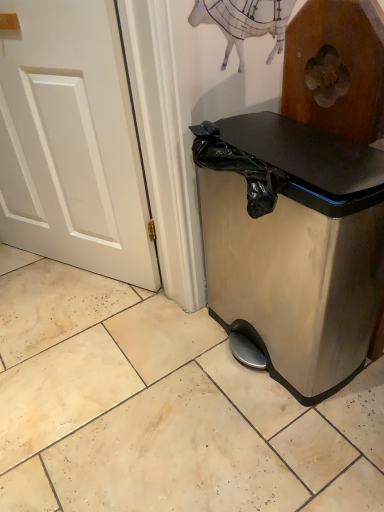
Question: Considering the positions of white painted wood door at left and satin silver trash can at lower right in the image, is white painted wood door at left wider or thinner than satin silver trash can at lower right?

Choices:
 (A) thin
 (B) wide

Answer: (A)

Question: From their relative heights in the image, would you say white painted wood door at left is taller or shorter than satin silver trash can at lower right?

Choices:
 (A) tall
 (B) short

Answer: (A)

Question: Would you say white painted wood door at left is to the left or to the right of satin silver trash can at lower right in the picture?

Choices:
 (A) left
 (B) right

Answer: (A)

Question: Looking at their shapes, would you say satin silver trash can at lower right is wider or thinner than white painted wood door at left?

Choices:
 (A) thin
 (B) wide

Answer: (B)

Question: From the image's perspective, relative to white painted wood door at left, is satin silver trash can at lower right above or below?

Choices:
 (A) below
 (B) above

Answer: (A)

Question: In terms of height, does satin silver trash can at lower right look taller or shorter compared to white painted wood door at left?

Choices:
 (A) short
 (B) tall

Answer: (A)

Question: Is satin silver trash can at lower right spatially inside white painted wood door at left, or outside of it?

Choices:
 (A) inside
 (B) outside

Answer: (B)